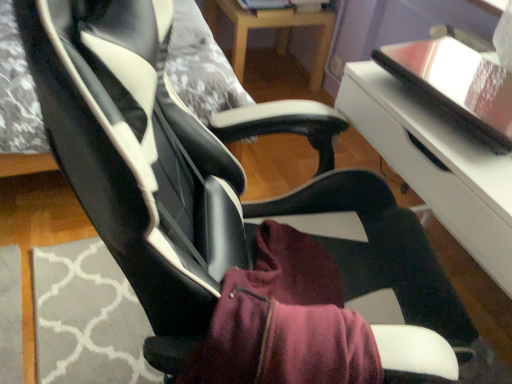
Question: Does white glossy table at center, marked as the first table in a bottom-to-top arrangement, have a larger size compared to wooden table at center, the 1th table in the top-to-bottom sequence?

Choices:
 (A) yes
 (B) no

Answer: (A)

Question: Considering the relative sizes of white glossy table at center, which is counted as the 2th table, starting from the back, and wooden table at center, the 1th table in the top-to-bottom sequence, in the image provided, is white glossy table at center, which is counted as the 2th table, starting from the back, shorter than wooden table at center, the 1th table in the top-to-bottom sequence,?

Choices:
 (A) yes
 (B) no

Answer: (B)

Question: From the image's perspective, would you say white glossy table at center, which appears as the second table when viewed from the top, is shown under wooden table at center, the first table in the back-to-front sequence?

Choices:
 (A) yes
 (B) no

Answer: (A)

Question: Can wooden table at center, placed as the 2th table when sorted from front to back, be found inside white glossy table at center, acting as the first table starting from the front?

Choices:
 (A) yes
 (B) no

Answer: (B)

Question: Is white glossy table at center, which appears as the second table when viewed from the top, taller than wooden table at center, placed as the 2th table when sorted from front to back?

Choices:
 (A) no
 (B) yes

Answer: (B)

Question: From the image's perspective, is white glossy table at center, which appears as the second table when viewed from the top, on top of wooden table at center, the first table in the back-to-front sequence?

Choices:
 (A) yes
 (B) no

Answer: (B)

Question: Can you confirm if wooden table at center, placed as the 2th table when sorted from front to back, is smaller than white glossy table at center, which is counted as the 2th table, starting from the back?

Choices:
 (A) yes
 (B) no

Answer: (A)

Question: Is wooden table at center, placed as the 2th table when sorted from front to back, oriented towards white glossy table at center, marked as the first table in a bottom-to-top arrangement?

Choices:
 (A) yes
 (B) no

Answer: (B)

Question: Does wooden table at center, the 1th table in the top-to-bottom sequence, appear on the left side of white glossy table at center, marked as the first table in a bottom-to-top arrangement?

Choices:
 (A) yes
 (B) no

Answer: (A)

Question: Does wooden table at center, which is counted as the 2th table, starting from the bottom, have a lesser width compared to white glossy table at center, which is counted as the 2th table, starting from the back?

Choices:
 (A) no
 (B) yes

Answer: (B)

Question: Considering the relative sizes of wooden table at center, the 1th table in the top-to-bottom sequence, and white glossy table at center, which appears as the second table when viewed from the top, in the image provided, is wooden table at center, the 1th table in the top-to-bottom sequence, taller than white glossy table at center, which appears as the second table when viewed from the top,?

Choices:
 (A) yes
 (B) no

Answer: (B)

Question: Is wooden table at center, the 1th table in the top-to-bottom sequence, facing away from white glossy table at center, which appears as the second table when viewed from the top?

Choices:
 (A) no
 (B) yes

Answer: (A)

Question: From the image's perspective, is white glossy table at center, marked as the first table in a bottom-to-top arrangement, above or below wooden table at center, which is counted as the 2th table, starting from the bottom?

Choices:
 (A) above
 (B) below

Answer: (B)